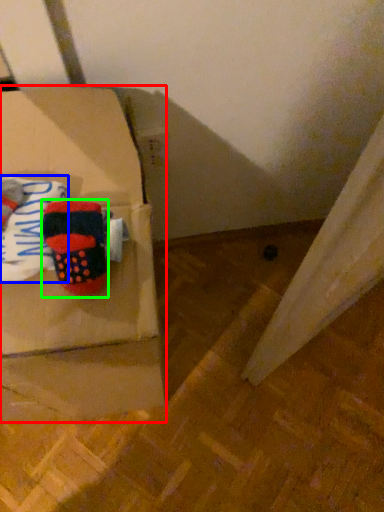
Question: Which is farther away from box (highlighted by a red box)? clothing (highlighted by a blue box) or footwear (highlighted by a green box)?

Choices:
 (A) clothing
 (B) footwear

Answer: (A)